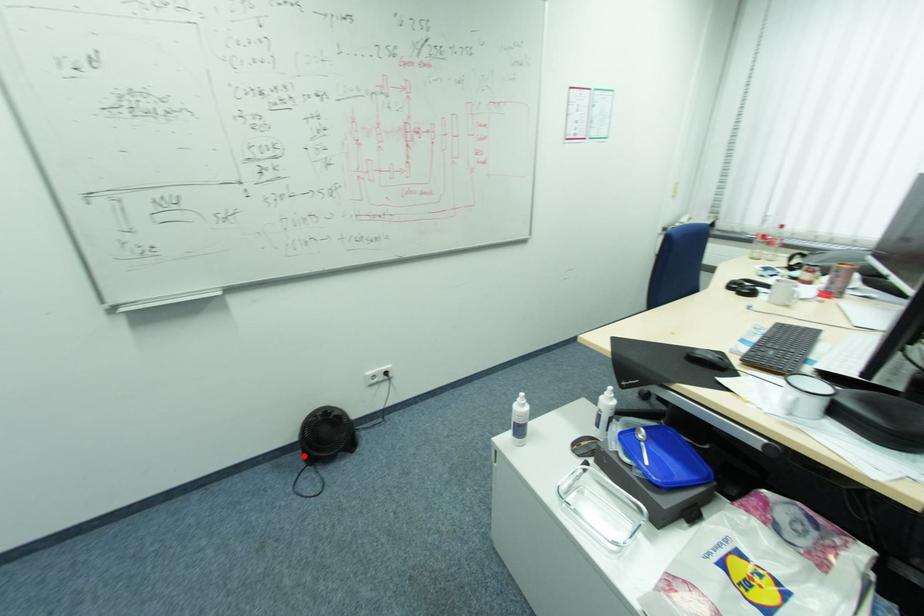
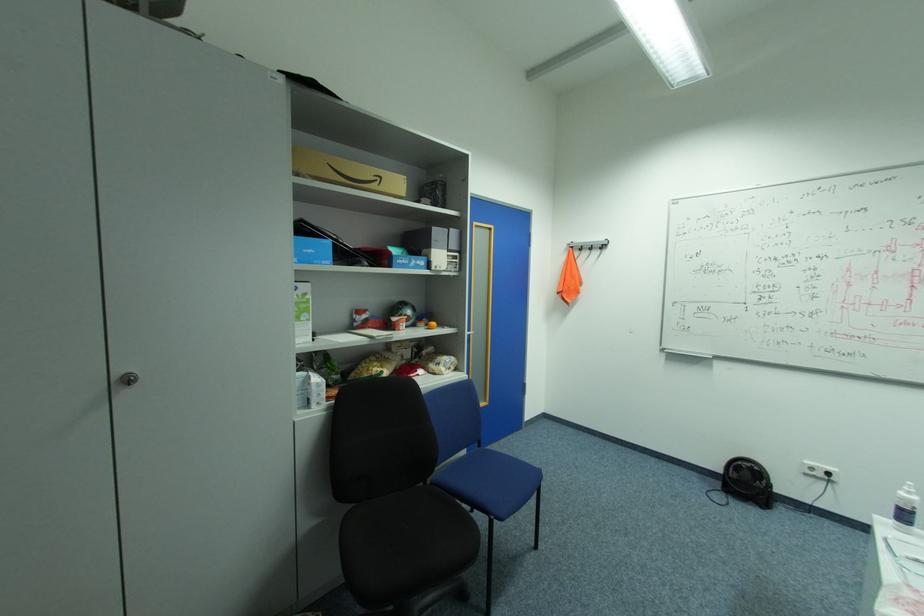
Question: I am providing you with two images of the same scene from different viewpoints. Given a red point in image1, look at the same physical point in image2. Is it:

Choices:
 (A) Closer to the viewpoint
 (B) Farther from the viewpoint

Answer: (A)